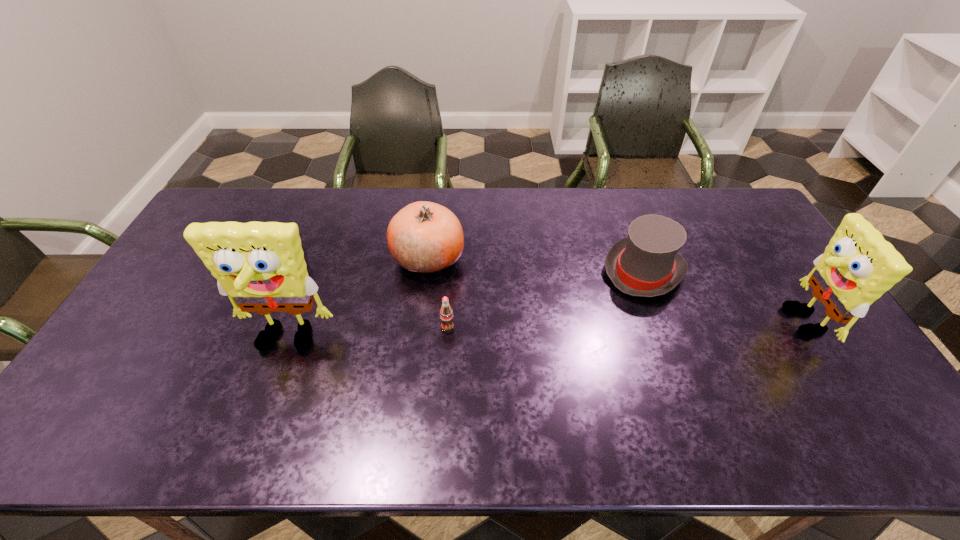
To ensure equal spacing by inserting another sponge among them, please point out a vacant spot for this new sponge. Please provide its 2D coordinates. Your answer should be formatted as a tuple, i.e. [(x, y)], where the tuple contains the x and y coordinates of a point satisfying the conditions above.

[(547, 332)]